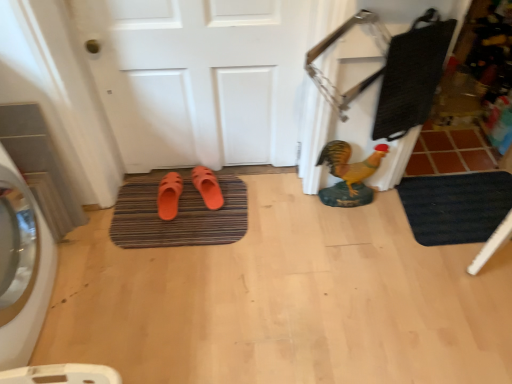
Image resolution: width=512 pixels, height=384 pixels. Identify the location of free spot in front of orange rubber slipper at center, marked as the 2th footwear in a right-to-left arrangement. (163, 234).